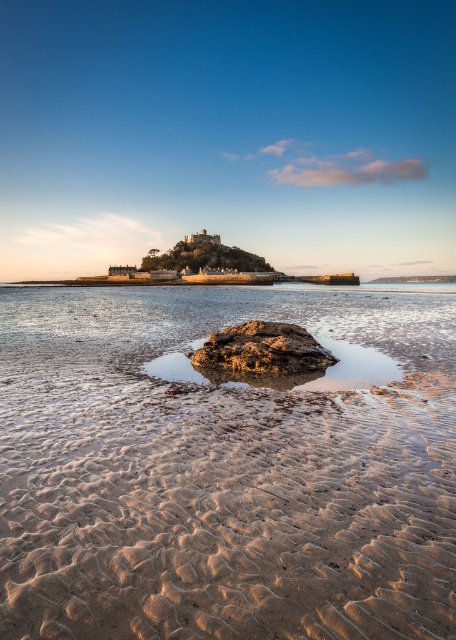
Is smooth sand at lower center thinner than rusty metallic rock at center?

Correct, smooth sand at lower center's width is less than rusty metallic rock at center's.

Where is `smooth sand at lower center`? The image size is (456, 640). smooth sand at lower center is located at coordinates (227, 512).

Locate an element on the screen. The height and width of the screenshot is (640, 456). smooth sand at lower center is located at coordinates (227, 512).